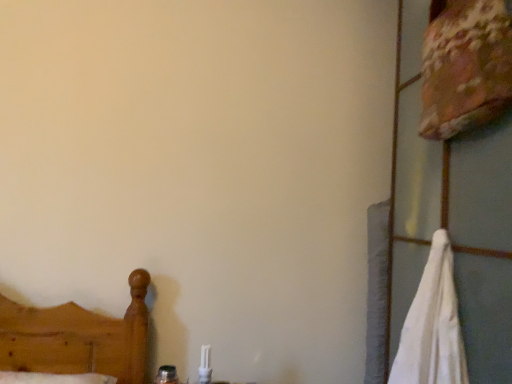
Question: Considering the positions of floral fabric pillow at upper right and white cotton bath towel at right in the image, is floral fabric pillow at upper right wider or thinner than white cotton bath towel at right?

Choices:
 (A) thin
 (B) wide

Answer: (A)

Question: From the image's perspective, is floral fabric pillow at upper right located above or below white cotton bath towel at right?

Choices:
 (A) above
 (B) below

Answer: (A)

Question: Is point (454, 49) closer or farther from the camera than point (459, 339)?

Choices:
 (A) farther
 (B) closer

Answer: (B)

Question: Based on their sizes in the image, would you say white cotton bath towel at right is bigger or smaller than floral fabric pillow at upper right?

Choices:
 (A) big
 (B) small

Answer: (A)

Question: Is white cotton bath towel at right wider or thinner than floral fabric pillow at upper right?

Choices:
 (A) thin
 (B) wide

Answer: (B)

Question: Considering their positions, is white cotton bath towel at right located in front of or behind floral fabric pillow at upper right?

Choices:
 (A) behind
 (B) front

Answer: (B)

Question: From a real-world perspective, is white cotton bath towel at right above or below floral fabric pillow at upper right?

Choices:
 (A) above
 (B) below

Answer: (B)